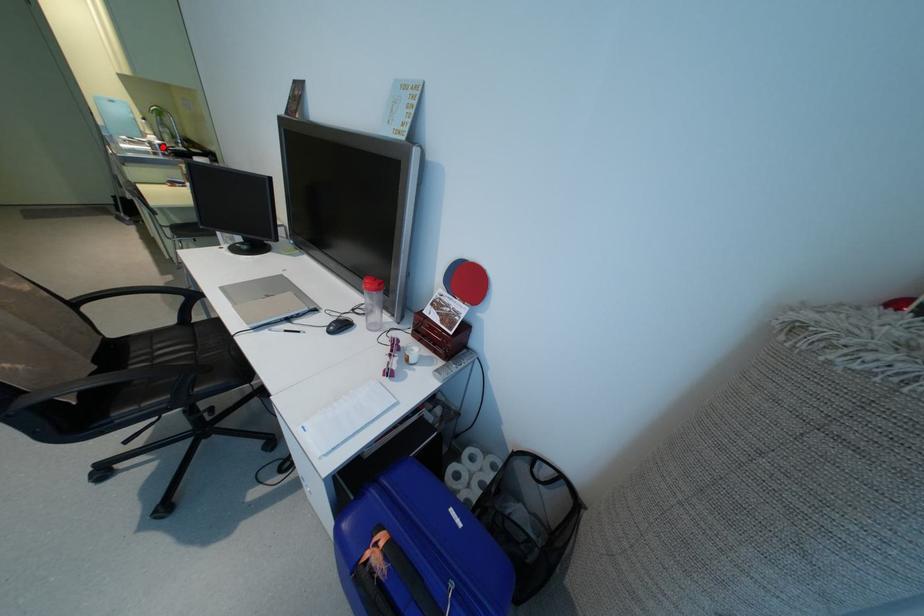
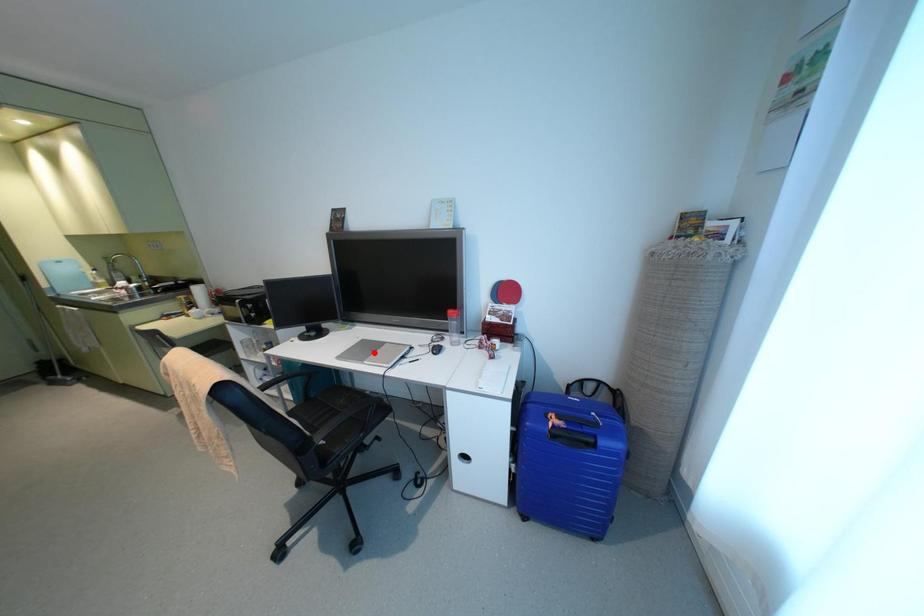
I am providing you with two images of the same scene from different viewpoints. A red point is marked on the first image and another point is marked on the second image. Is the marked point in image1 the same physical position as the marked point in image2?

No